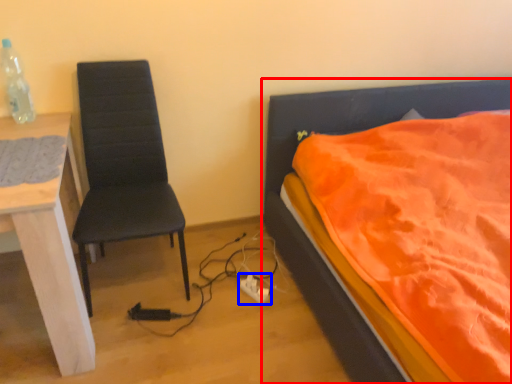
Question: Which object appears closest to the camera in this image, bed (highlighted by a red box) or power plugs and sockets (highlighted by a blue box)?

Choices:
 (A) bed
 (B) power plugs and sockets

Answer: (A)